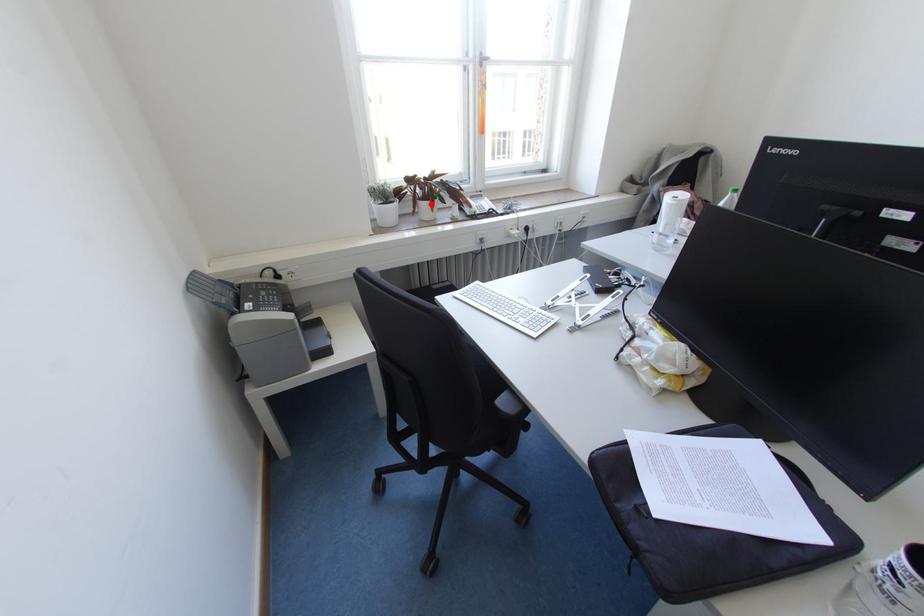
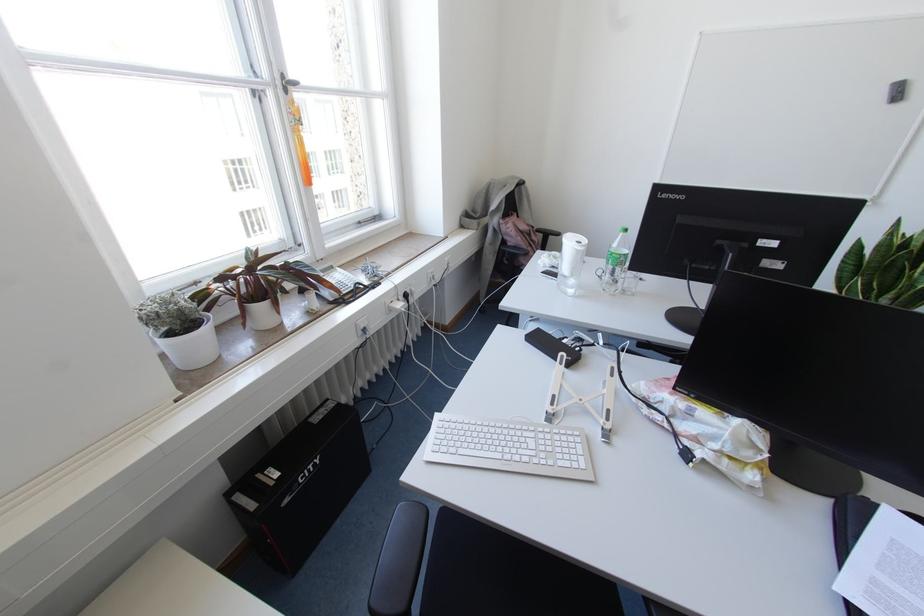
The point at the highlighted location is marked in the first image. Where is the corresponding point in the second image?

(274, 302)